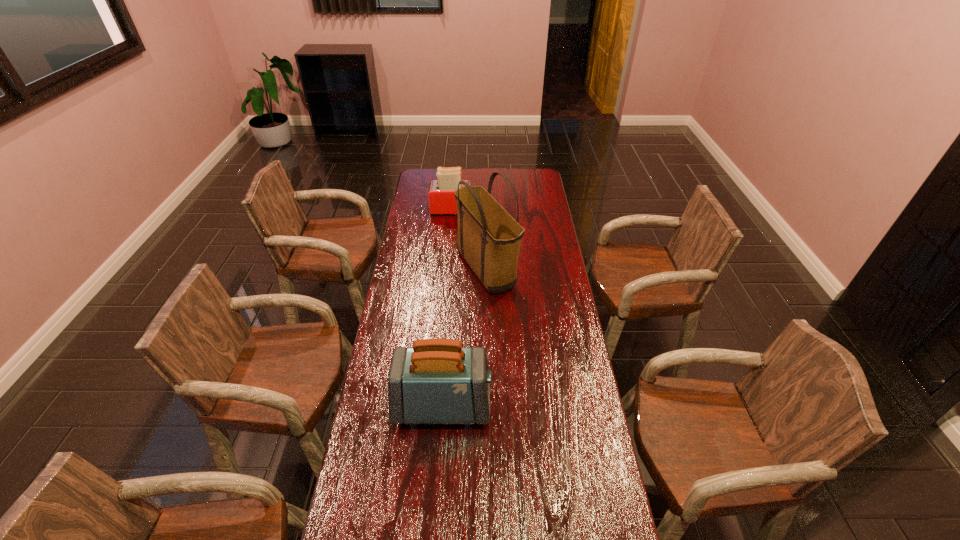
Locate an element on the screen. This screenshot has width=960, height=540. free location that satisfies the following two spatial constraints: 1. on the front-facing side of the second farthest object; 2. on the right side of the shortest object is located at coordinates (448, 271).